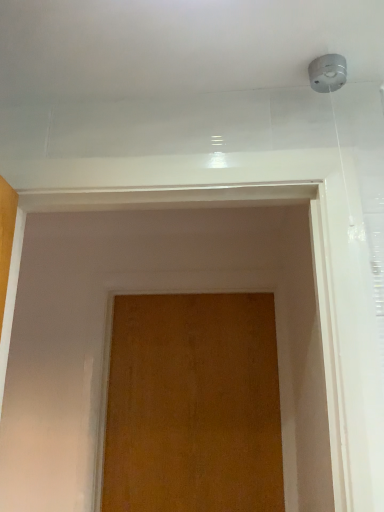
Describe the element at coordinates (193, 405) in the screenshot. I see `brown wooden door at center` at that location.

In order to face brown wooden door at center, should I rotate leftwards or rightwards?

You should look left and rotate roughly 0.441 degrees.

Locate an element on the screen. brown wooden door at center is located at coordinates (193, 405).

Measure the distance between brown wooden door at center and camera.

The depth of brown wooden door at center is 1.69 meters.

Where is `brown wooden door at center`? This screenshot has height=512, width=384. brown wooden door at center is located at coordinates (193, 405).